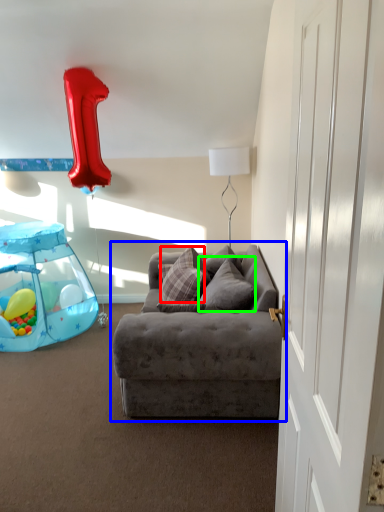
Question: Based on their relative distances, which object is nearer to pillow (highlighted by a red box)? Choose from studio couch (highlighted by a blue box) and pillow (highlighted by a green box).

Choices:
 (A) studio couch
 (B) pillow

Answer: (B)